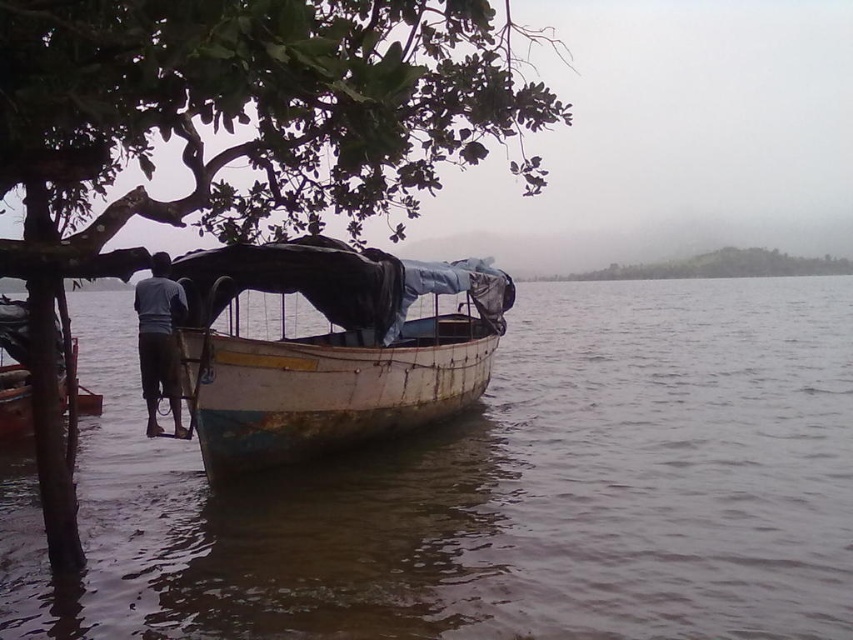
Between brown murky water at boat left and green leafy tree at upper center, which one has less height?

Standing shorter between the two is green leafy tree at upper center.

Can you confirm if brown murky water at boat left is wider than green leafy tree at upper center?

Indeed, brown murky water at boat left has a greater width compared to green leafy tree at upper center.

Is point (564, 573) more distant than point (759, 275)?

No.

Where is `brown murky water at boat left`? brown murky water at boat left is located at coordinates (494, 490).

Consider the image. Which is below, brown murky water at boat left or dark blue fabric at left?

dark blue fabric at left is lower down.

Does point (413, 493) come closer to viewer compared to point (170, 326)?

No, (413, 493) is further to viewer.

Which is behind, point (843, 406) or point (158, 376)?

The point (843, 406) is more distant.

Identify the location of brown murky water at boat left. The image size is (853, 640). (494, 490).

Which is below, green leafy tree at upper left or wooden boat at center?

wooden boat at center is below.

Which of these two, green leafy tree at upper left or wooden boat at center, stands shorter?

With less height is wooden boat at center.

Is point (19, 97) less distant than point (207, 449)?

Yes, it is in front of point (207, 449).

This screenshot has width=853, height=640. I want to click on green leafy tree at upper left, so click(231, 132).